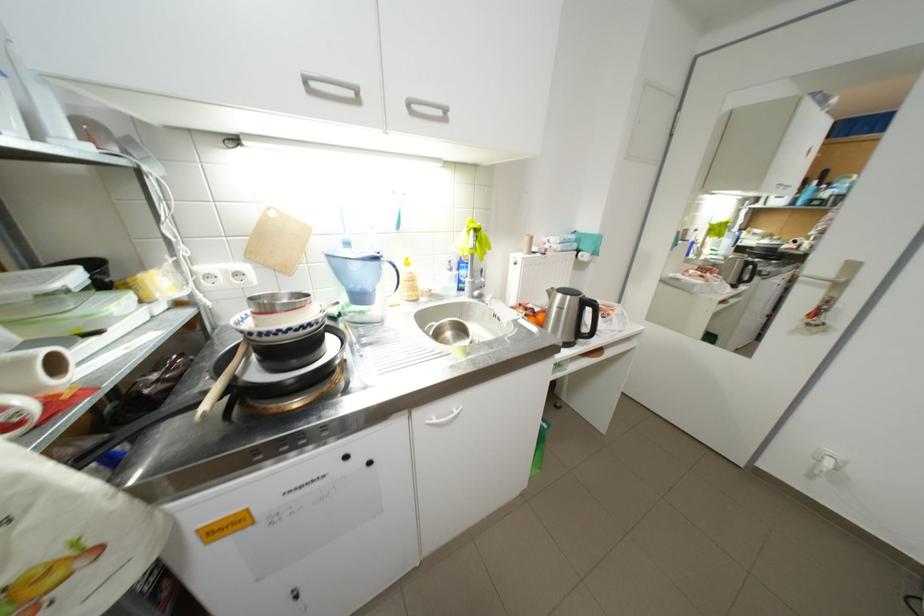
At what (x,y) coordinates should I click in order to perform the action: click on wooden spoon handle. Please return your answer as a coordinate pair (x, y). Looking at the image, I should click on (223, 381).